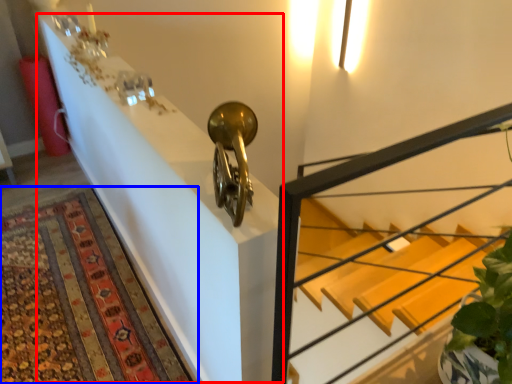
Question: Which of the following is the farthest to the observer, table (highlighted by a red box) or mat (highlighted by a blue box)?

Choices:
 (A) table
 (B) mat

Answer: (B)